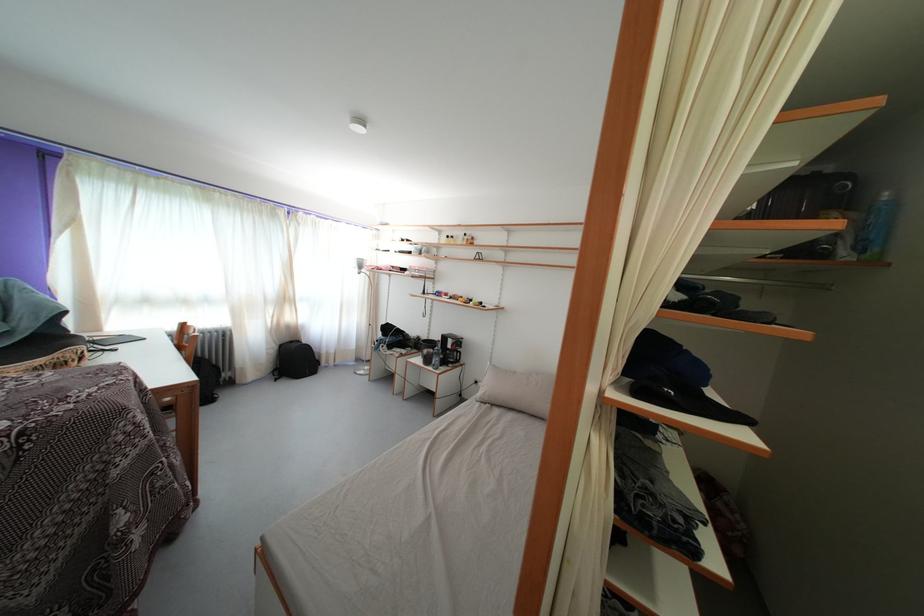
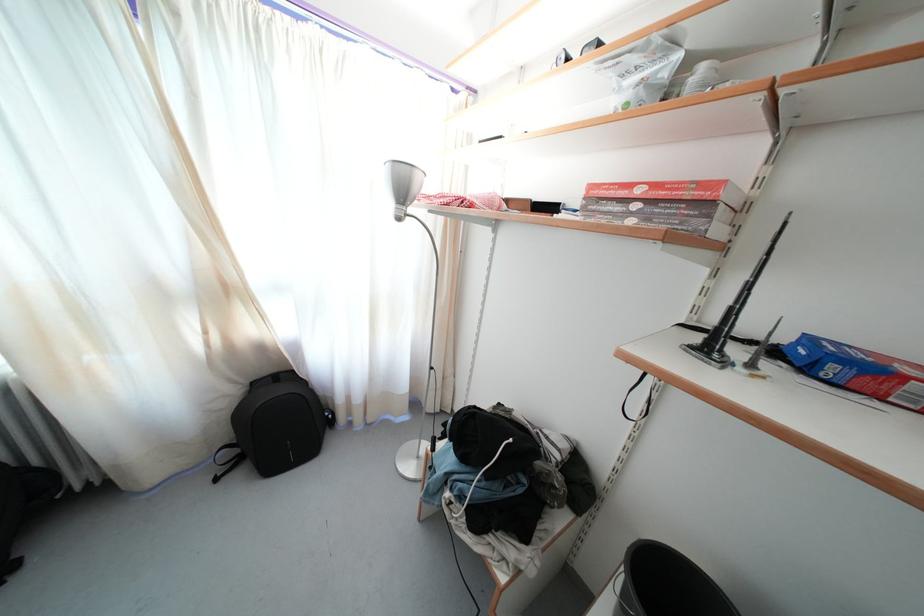
In the second image, find the point that corresponds to point (367, 272) in the first image.

(408, 199)